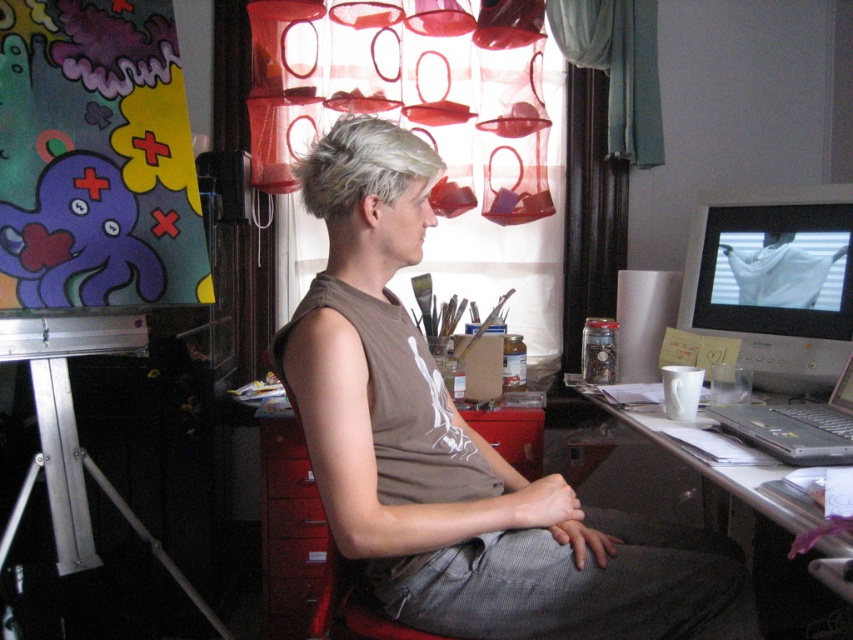
Is matte black monitor at upper right wider than silver metallic laptop at right?

No.

The width and height of the screenshot is (853, 640). Describe the element at coordinates (775, 282) in the screenshot. I see `matte black monitor at upper right` at that location.

Image resolution: width=853 pixels, height=640 pixels. What are the coordinates of `matte black monitor at upper right` in the screenshot? It's located at pyautogui.click(x=775, y=282).

Does white glossy table at lower right have a greater width compared to silver metallic laptop at right?

No.

Is white glossy table at lower right smaller than silver metallic laptop at right?

Actually, white glossy table at lower right might be larger than silver metallic laptop at right.

Does point (844, 556) come farther from viewer compared to point (842, 432)?

No, it is in front of (842, 432).

Find the location of `white glossy table at lower right`. white glossy table at lower right is located at coordinates (753, 522).

The width and height of the screenshot is (853, 640). I want to click on brown cotton tank top at center, so click(x=457, y=449).

Which is in front, point (393, 248) or point (811, 444)?

Point (393, 248) is more forward.

Between point (363, 348) and point (820, 449), which one is positioned behind?

Point (820, 449)

This screenshot has width=853, height=640. In order to click on brown cotton tank top at center in this screenshot , I will do `click(457, 449)`.